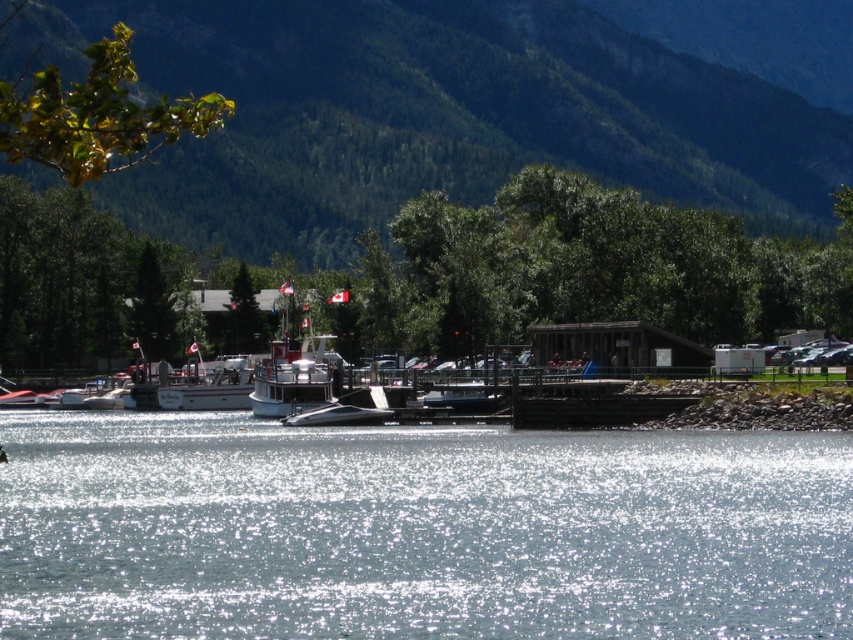
You are planning to launch a small kayak from the dock. The kayak requires a width of 2 meters to safely enter the water. Based on the scene, can the sparkling silver water at center provide enough width for the white glossy boat at center to exit without obstruction?

The sparkling silver water at center might be wider than white glossy boat at center, so there is a possibility that the water is wide enough for the boat to exit safely. However, the exact width isn not specified, so further measurement would be needed to confirm.